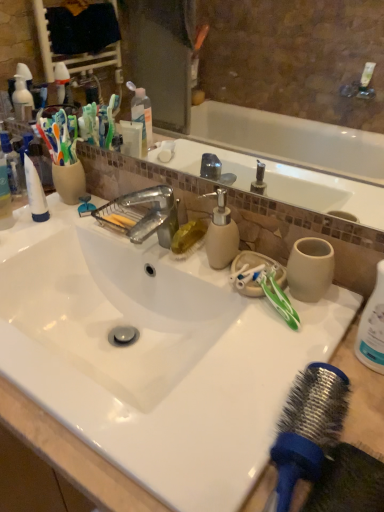
The width and height of the screenshot is (384, 512). What are the coordinates of `free spot above white glossy sink at center (from a real-world perspective)` in the screenshot? It's located at (179, 273).